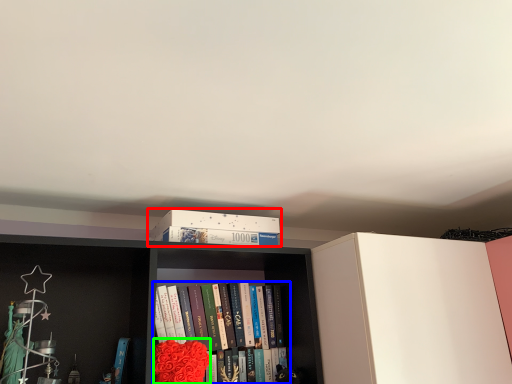
Question: Which object is the closest to the book cover (highlighted by a red box)? Choose among these: book (highlighted by a blue box) or flower (highlighted by a green box).

Choices:
 (A) book
 (B) flower

Answer: (A)